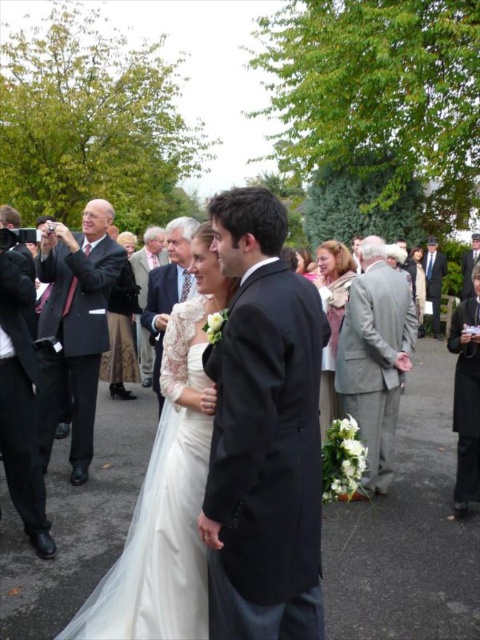
Question: Does matte pink dress at center have a lesser width compared to light beige fabric coat at center?

Choices:
 (A) no
 (B) yes

Answer: (B)

Question: Estimate the real-world distances between objects in this image. Which object is farther from the black wool suit at right?

Choices:
 (A) dark gray suit at center
 (B) shiny black suit at left
 (C) gray wool suit at center

Answer: (A)

Question: Among these objects, which one is nearest to the camera?

Choices:
 (A) dark gray suit at center
 (B) black satin suit at center
 (C) dark blue suit at right

Answer: (B)

Question: Is light brown textured suit at center positioned at the back of dark gray suit at center?

Choices:
 (A) yes
 (B) no

Answer: (B)

Question: Considering the real-world distances, which object is closest to the dark suit at left?

Choices:
 (A) white satin dress at center
 (B) ivory lace dress at center
 (C) light beige fabric coat at center

Answer: (B)

Question: Can you confirm if white satin dress at center is wider than ivory lace dress at center?

Choices:
 (A) yes
 (B) no

Answer: (A)